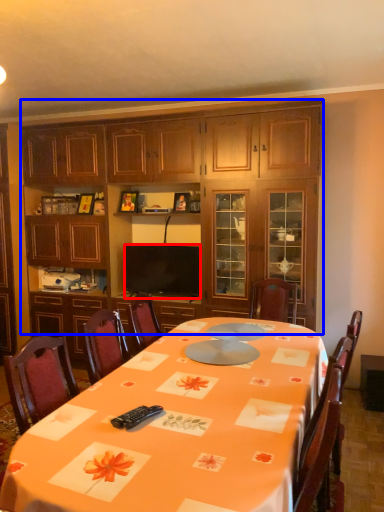
Question: Which point is further to the camera, television (highlighted by a red box) or cabinetry (highlighted by a blue box)?

Choices:
 (A) television
 (B) cabinetry

Answer: (A)